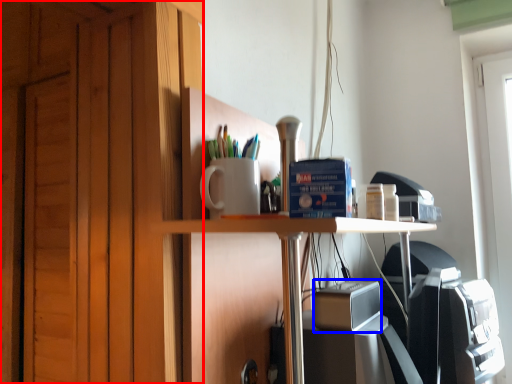
Question: Among these objects, which one is nearest to the camera, dresser (highlighted by a red box) or appliance (highlighted by a blue box)?

Choices:
 (A) dresser
 (B) appliance

Answer: (B)